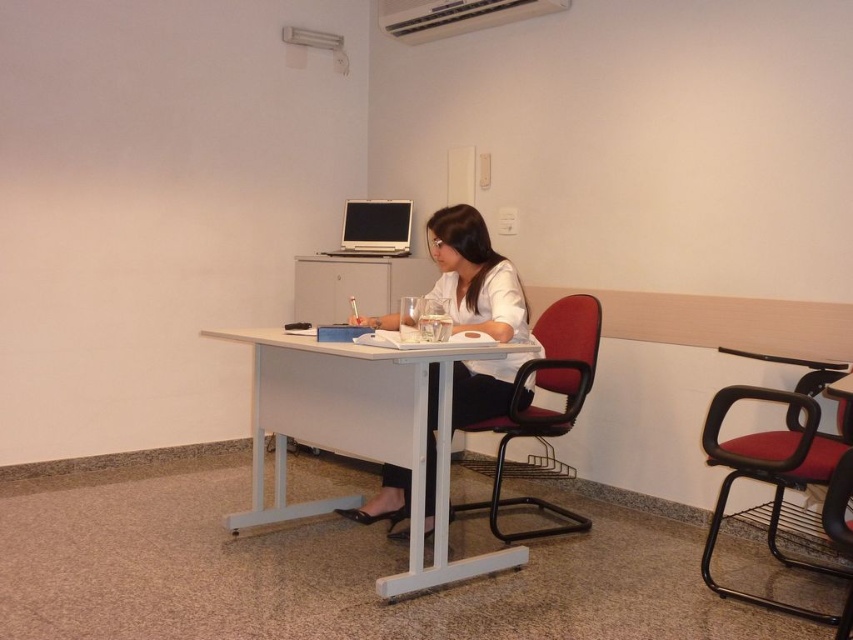
You are organizing a desk and need to place the white matte shirt at center and the silver metallic laptop at center. Given their sizes, which object should you place first to ensure both fit properly?

The white matte shirt at center is larger in size than the silver metallic laptop at center, so you should place the white matte shirt at center first to accommodate its larger size before placing the smaller laptop.

You are a delivery robot with a width of 1 meter. You need to navigate through the space between the white matte shirt at center and the silver metallic laptop at center to deliver a package. Can you fit through the space?

The distance between the white matte shirt at center and the silver metallic laptop at center is 1.31 meters, which is wider than the robot width of 1 meter. Therefore, the robot can fit through the space between the white matte shirt at center and the silver metallic laptop at center.